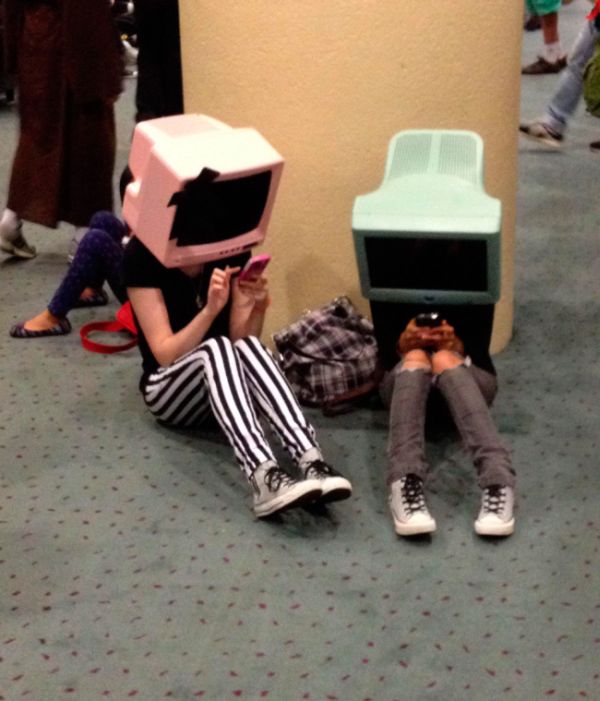
Locate an element on the screen. 2 bags on floor is located at coordinates (352, 365), (113, 332).